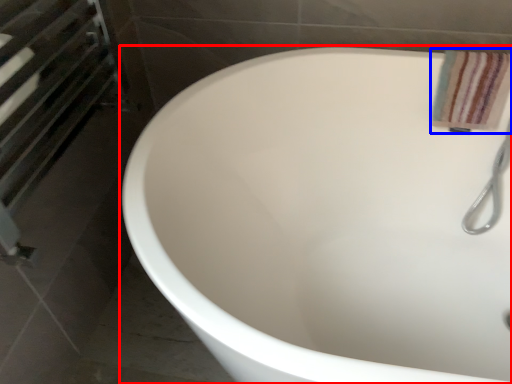
Question: Among these objects, which one is nearest to the camera, bathtub (highlighted by a red box) or bath towel (highlighted by a blue box)?

Choices:
 (A) bathtub
 (B) bath towel

Answer: (A)